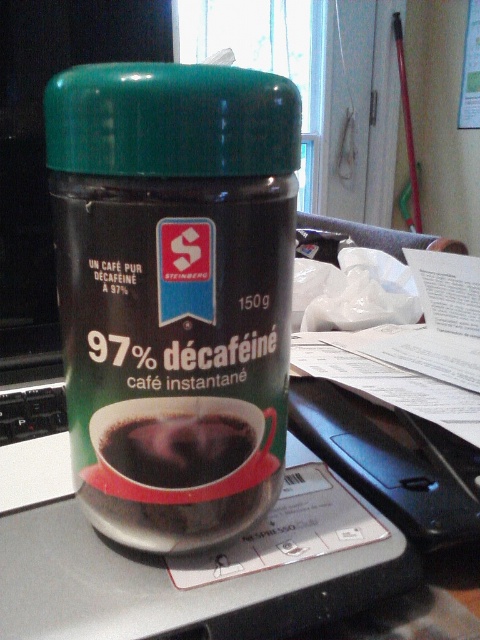
You are looking at the jar of decaffeinated instant coffee. There are two points marked on the jar. One is at coordinate point (118, 83) and the other is at coordinate point (199, 476). Which point is closer to you?

The point at coordinate (118, 83) is closer to you than the point at coordinate (199, 476).

You are organizing a coffee tasting event and have both the green glossy lid at center and the dark matte coffee cup at center on the table. Which object should you pick up first if you need to prepare a cup of coffee?

You should pick up the dark matte coffee cup at center first because the green glossy lid at center is larger in size and likely belongs to the coffee jar, so the cup is needed to pour the coffee into.

You are a barista preparing a coffee order. You need to place the green matte jar at center and the dark matte coffee cup at center on a shelf. According to the image, which object should be placed higher on the shelf?

The green matte jar at center should be placed higher on the shelf because it is positioned above the dark matte coffee cup at center in the image.